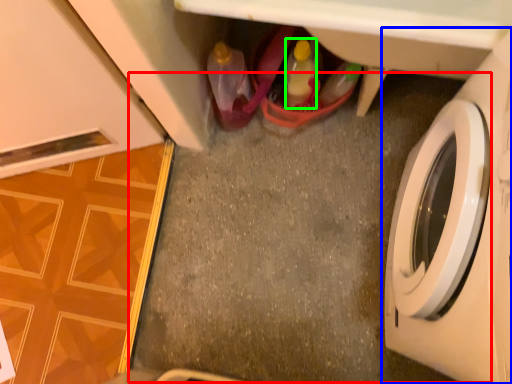
Question: Considering the real-world distances, which object is farthest from concrete (highlighted by a red box)? washing machine (highlighted by a blue box) or bottle (highlighted by a green box)?

Choices:
 (A) washing machine
 (B) bottle

Answer: (A)